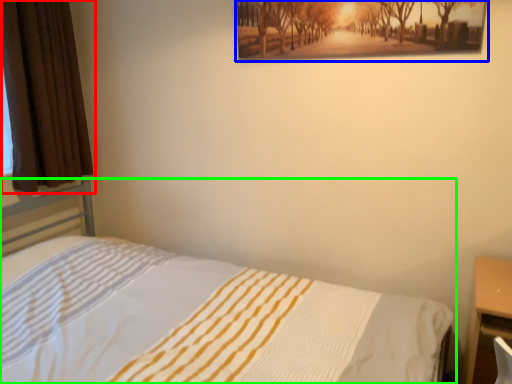
Question: Considering the real-world distances, which object is closest to curtain (highlighted by a red box)? picture frame (highlighted by a blue box) or bed (highlighted by a green box).

Choices:
 (A) picture frame
 (B) bed

Answer: (B)